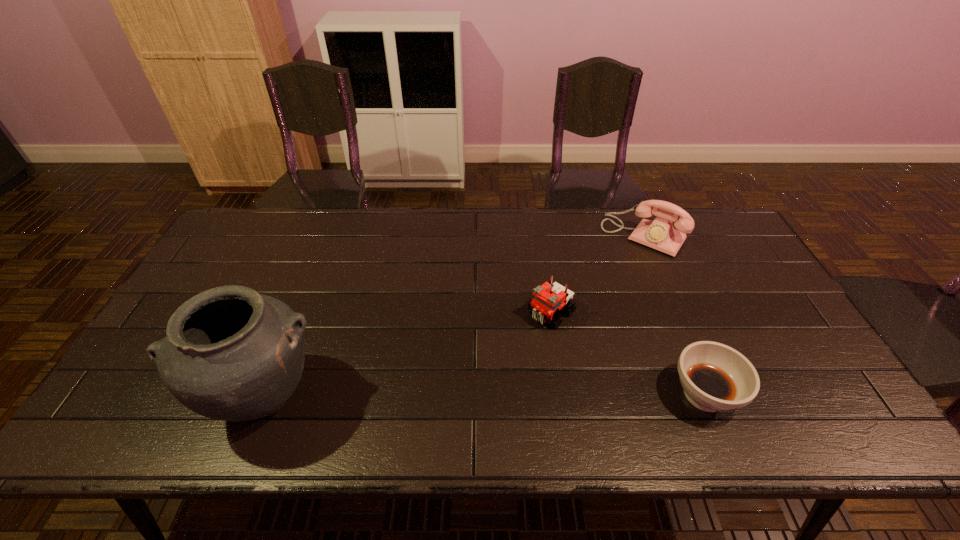
Locate an element on the screen. vacant spot on the desktop that is between the tallest object and the shortest object and is positioned on the front-facing side of the Lego is located at coordinates (459, 396).

The height and width of the screenshot is (540, 960). I want to click on vacant space on the desktop that is between the tallest object and the shortest object and is positioned on the dial of the farthest object, so (x=528, y=396).